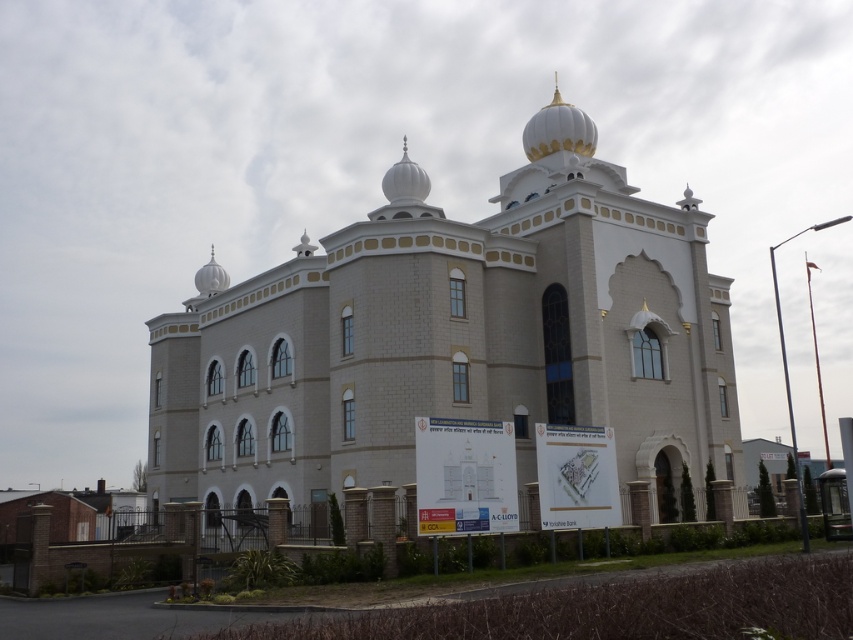
Question: Does white stone church at center come behind white glossy dome at upper center?

Choices:
 (A) yes
 (B) no

Answer: (B)

Question: Does white stone church at center lie in front of white glossy dome at upper center?

Choices:
 (A) no
 (B) yes

Answer: (B)

Question: Which of the following is the closest to the observer?

Choices:
 (A) (583, 122)
 (B) (634, 307)

Answer: (B)

Question: Can you confirm if white stone church at center is thinner than white glossy dome at upper center?

Choices:
 (A) yes
 (B) no

Answer: (B)

Question: Which object appears closest to the camera in this image?

Choices:
 (A) white stone church at center
 (B) white glossy dome at upper center

Answer: (A)